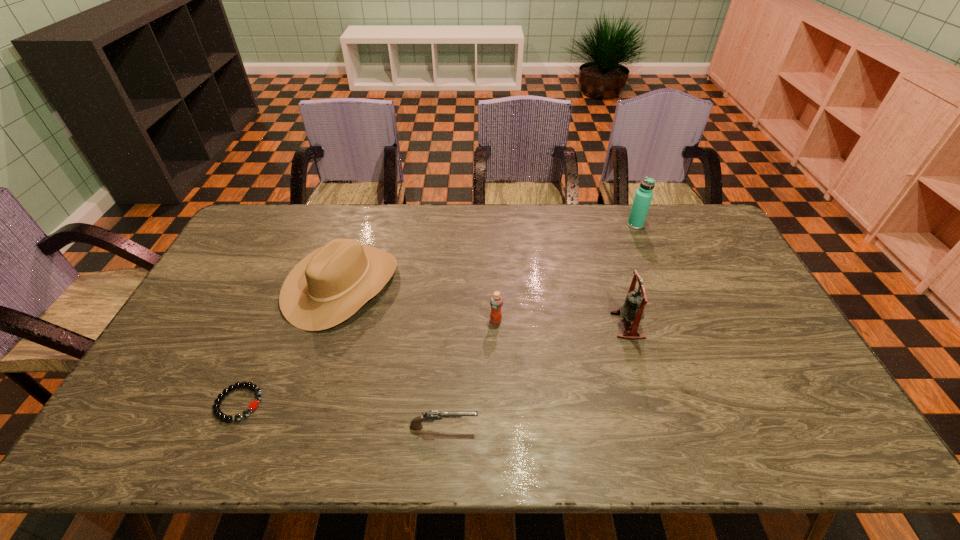
The width and height of the screenshot is (960, 540). What are the coordinates of `free space that is in between the fourth object from right to left and the orange juice` in the screenshot? It's located at (469, 374).

This screenshot has height=540, width=960. In order to click on blank region between the second object from right to left and the bracelet in this screenshot , I will do `click(433, 364)`.

Where is `free space between the fourth shortest object and the gun`? This screenshot has height=540, width=960. free space between the fourth shortest object and the gun is located at coordinates (393, 356).

In order to click on the fifth closest object to the shortest object in this screenshot , I will do (643, 196).

Locate an element on the screen. This screenshot has height=540, width=960. the closest object relative to the thermos bottle is located at coordinates (633, 308).